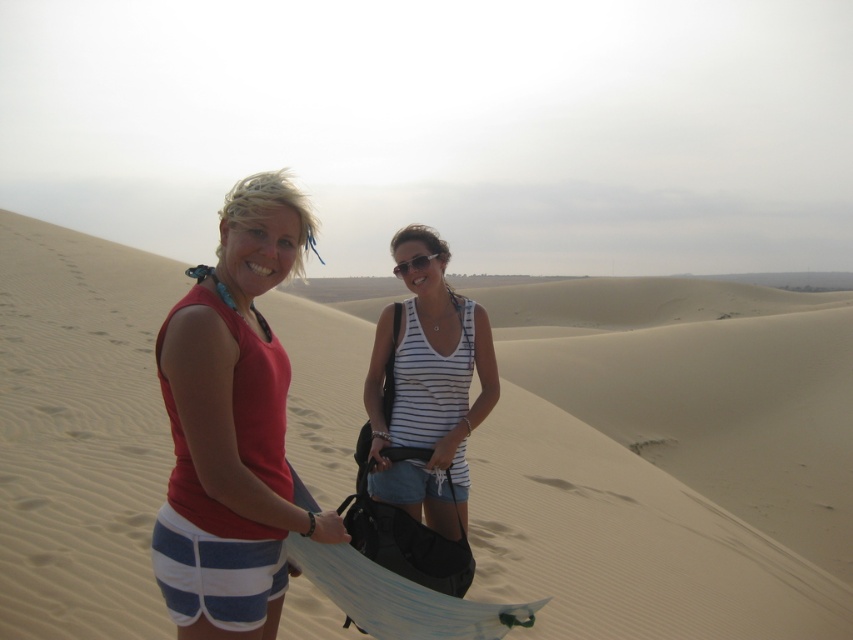
Question: Considering the relative positions of beige sandy dunes at center and white striped tank top at center in the image provided, where is beige sandy dunes at center located with respect to white striped tank top at center?

Choices:
 (A) right
 (B) left

Answer: (B)

Question: Based on their relative distances, which object is nearer to the beige sandy dunes at center?

Choices:
 (A) black plastic sunglasses at center
 (B) matte red tank top at left

Answer: (B)

Question: Is matte red tank top at left further to camera compared to white striped tank top at center?

Choices:
 (A) no
 (B) yes

Answer: (A)

Question: Is beige sandy dunes at center bigger than matte red tank top at left?

Choices:
 (A) yes
 (B) no

Answer: (A)

Question: Estimate the real-world distances between objects in this image. Which object is closer to the beige sandy dunes at center?

Choices:
 (A) matte red tank top at left
 (B) white striped tank top at center

Answer: (B)

Question: Which object appears closest to the camera in this image?

Choices:
 (A) matte red tank top at left
 (B) black plastic sunglasses at center
 (C) white striped tank top at center

Answer: (A)